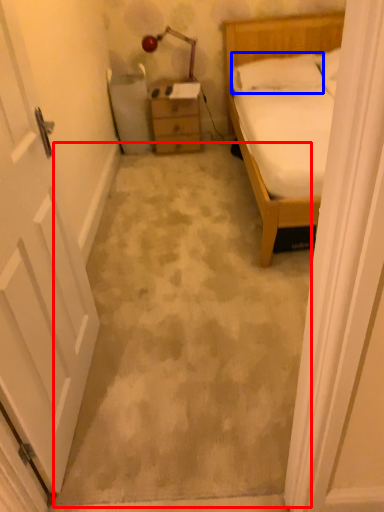
Question: Which point is closer to the camera, concrete (highlighted by a red box) or pillow (highlighted by a blue box)?

Choices:
 (A) concrete
 (B) pillow

Answer: (A)